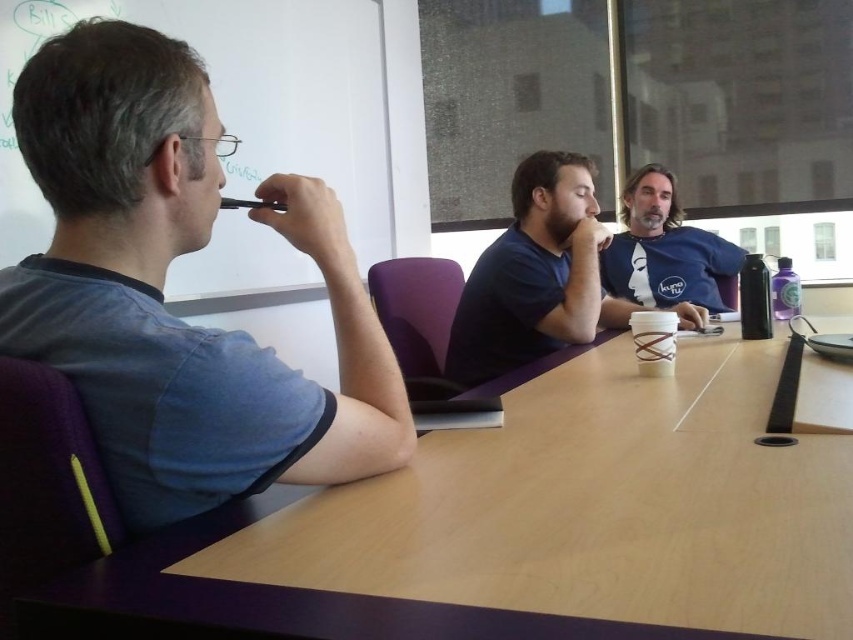
Question: Can you confirm if light brown wood table at center is bigger than blue cotton shirt at left?

Choices:
 (A) no
 (B) yes

Answer: (B)

Question: Which point is closer to the camera?

Choices:
 (A) blue cotton shirt at left
 (B) blue cotton shirt at upper center
 (C) matte blue shirt at center
 (D) light brown wood table at center

Answer: (D)

Question: Can you confirm if light brown wood table at center is positioned below blue cotton shirt at left?

Choices:
 (A) yes
 (B) no

Answer: (A)

Question: Based on their relative distances, which object is nearer to the matte blue shirt at center?

Choices:
 (A) light brown wood table at center
 (B) blue cotton shirt at left

Answer: (A)

Question: Is blue cotton shirt at left wider than blue cotton shirt at upper center?

Choices:
 (A) yes
 (B) no

Answer: (B)

Question: Considering the real-world distances, which object is closest to the matte blue shirt at center?

Choices:
 (A) light brown wood table at center
 (B) blue cotton shirt at upper center
 (C) blue cotton shirt at left

Answer: (A)